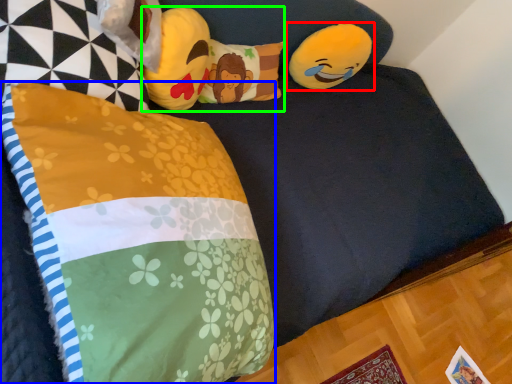
Question: Estimate the real-world distances between objects in this image. Which object is farther from toy (highlighted by a red box), pillow (highlighted by a blue box) or toy (highlighted by a green box)?

Choices:
 (A) pillow
 (B) toy

Answer: (A)